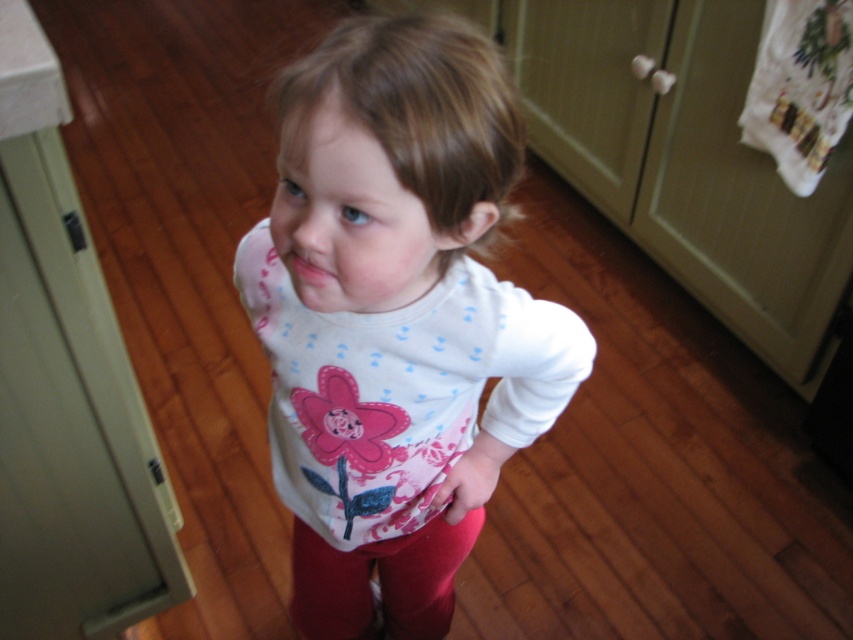
You are a photographer setting up for a portrait. You need to ensure that the white soft shirt at center and smooth skin face at center are both visible in the frame. Considering their sizes, which one might you need to adjust your camera angle to better include in the shot?

The white soft shirt at center is much taller than the smooth skin face at center, so you might need to adjust your camera angle to ensure the entire shirt is captured in the frame while keeping the face visible.

The child in the scene is wearing a white soft shirt at center and has pink matte lips at center. Which of these two features is larger in size?

The white soft shirt at center is bigger than the pink matte lips at center.

The child in the image is wearing a white soft shirt at center and has a smooth skin face at center. Which object is positioned to the right of the other?

The white soft shirt at center is to the right of smooth skin face at center.